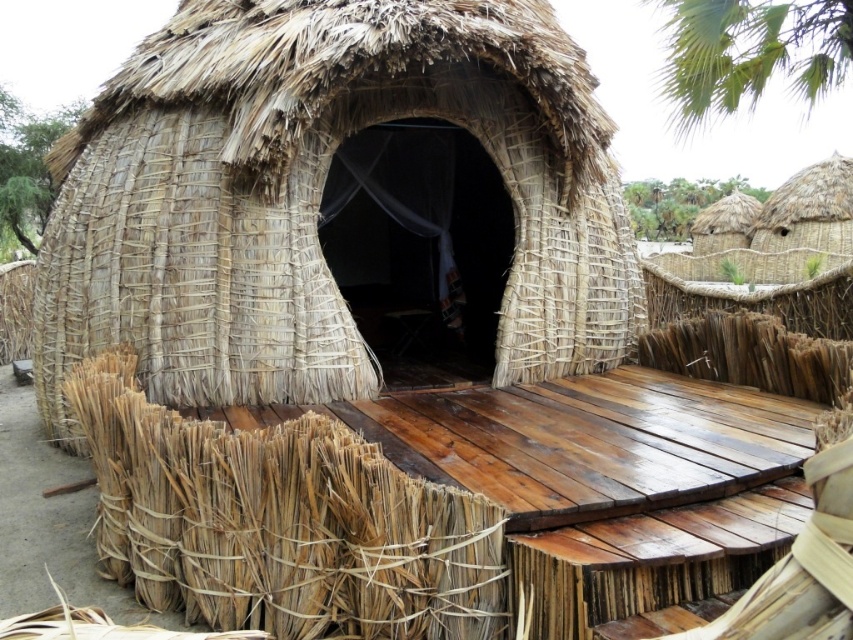
You are standing outside the thatched hut and want to walk from point A to point B. The coordinates for point A are point [200,109] and for point B are point [708,76]. Since you can only walk forward, will you be able to reach point B without turning?

Point [200,109] is in front of point [708,76], so if you walk straight forward from point A, you will pass point B. However, since point B is behind point A relative to your starting position, you would need to walk backward or turn to reach it. Therefore, you cannot reach point B without turning.

You are standing outside the natural straw hut at center and want to take a photo of it with the green leafy palm tree at upper right in the background. Will the palm tree be visible in the photo if you position yourself directly in front of the hut?

The natural straw hut at center is closer to the viewer than the green leafy palm tree at upper right, so if you position yourself directly in front of the hut, the palm tree will be visible in the background of the photo.

You are an architect assessing two traditional thatched huts in the image. The first is the natural straw hut at center, and the second is the natural straw hut at upper right. Based on their height, which one would require a taller ladder for roof maintenance?

The natural straw hut at upper right requires a taller ladder because it is taller than the natural straw hut at center.